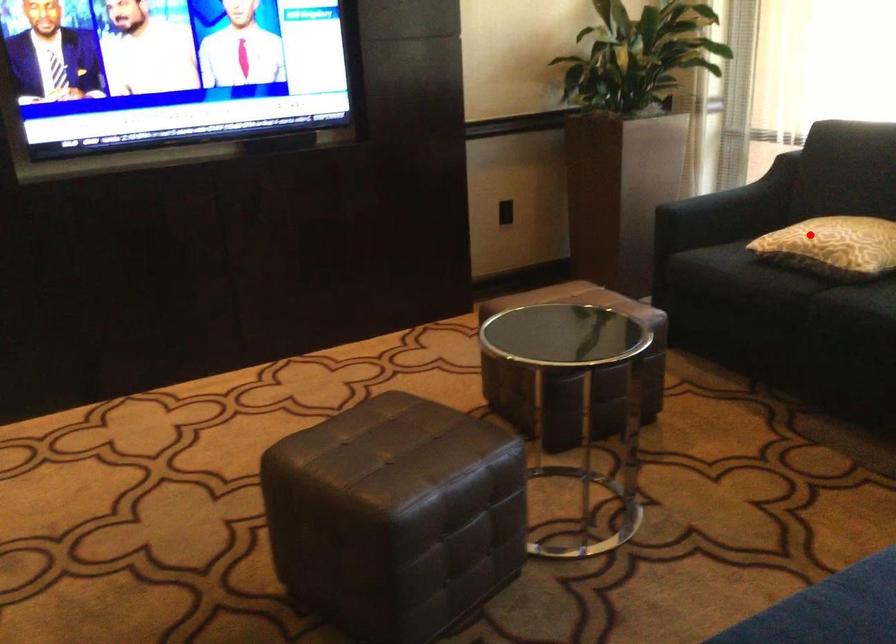
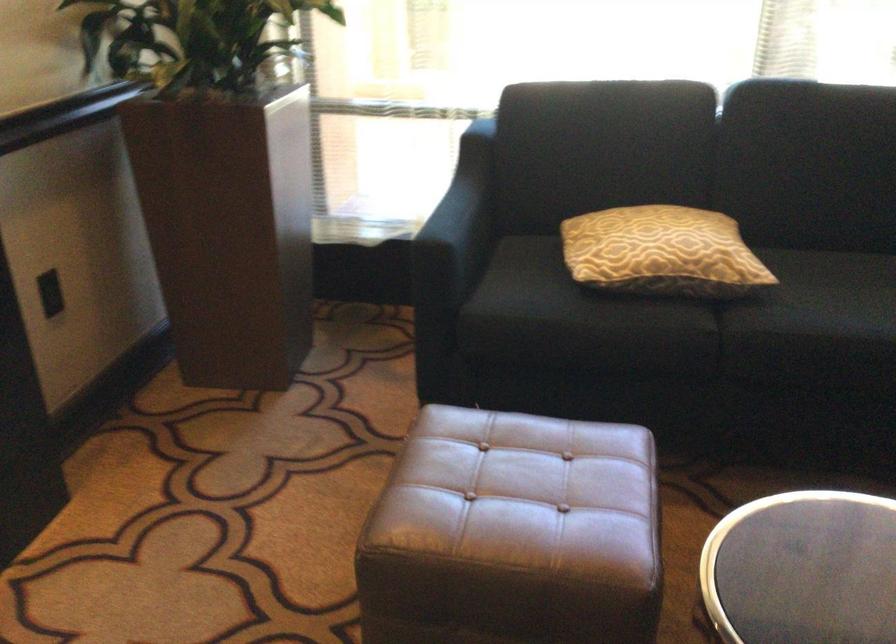
The point at the highlighted location is marked in the first image. Where is the corresponding point in the second image?

(661, 252)